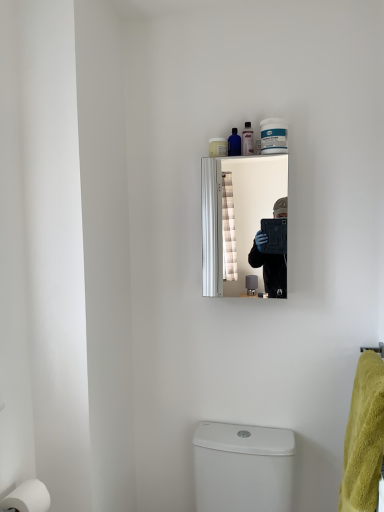
Identify the location of translucent plastic bottle at upper center, positioned as the 1th toiletry in right-to-left order. (247, 140).

Describe the element at coordinates (243, 467) in the screenshot. I see `white glossy toilet at lower center` at that location.

Measure the distance between silver metallic mirror at upper center and camera.

They are 4.86 feet apart.

Describe the element at coordinates (234, 143) in the screenshot. I see `translucent blue bottle at upper center, placed as the 2th toiletry when sorted from right to left` at that location.

In order to face yellow fluffy bath towel at right, should I rotate leftwards or rightwards?

Turn right approximately 22.212 degrees to face it.

You are a GUI agent. You are given a task and a screenshot of the screen. Output one action in this format:
    pyautogui.click(x=<x>, y=<y>)
    Task: Click on the translucent plastic bottle at upper center, positioned as the 1th toiletry in right-to-left order
    The width and height of the screenshot is (384, 512).
    Given the screenshot: What is the action you would take?
    pyautogui.click(x=247, y=140)

Which object is closer to the camera, translucent plastic bottle at upper center, positioned as the 3th toiletry in left-to-right order, or translucent plastic soap dispenser at upper center, the third toiletry viewed from the right?

translucent plastic bottle at upper center, positioned as the 3th toiletry in left-to-right order, is in front.

From the image's perspective, relative to translucent plastic soap dispenser at upper center, the third toiletry viewed from the right, is translucent plastic bottle at upper center, positioned as the 3th toiletry in left-to-right order, above or below?

From the image's perspective, translucent plastic bottle at upper center, positioned as the 3th toiletry in left-to-right order, appears above translucent plastic soap dispenser at upper center, the third toiletry viewed from the right.

How different are the orientations of translucent plastic bottle at upper center, positioned as the 1th toiletry in right-to-left order, and translucent plastic soap dispenser at upper center, the first toiletry in the left-to-right sequence, in degrees?

The angle between the facing direction of translucent plastic bottle at upper center, positioned as the 1th toiletry in right-to-left order, and the facing direction of translucent plastic soap dispenser at upper center, the first toiletry in the left-to-right sequence, is 0.018 degrees.

Does translucent plastic bottle at upper center, positioned as the 1th toiletry in right-to-left order, appear on the right side of translucent plastic soap dispenser at upper center, the first toiletry in the left-to-right sequence?

Yes, translucent plastic bottle at upper center, positioned as the 1th toiletry in right-to-left order, is to the right of translucent plastic soap dispenser at upper center, the first toiletry in the left-to-right sequence.

Would you consider white glossy toilet at lower center to be distant from silver metallic mirror at upper center?

No, there isn't a large distance between white glossy toilet at lower center and silver metallic mirror at upper center.

From the image's perspective, is white glossy toilet at lower center over silver metallic mirror at upper center?

No, from the image's perspective, white glossy toilet at lower center is not over silver metallic mirror at upper center.

Looking at this image, is white glossy toilet at lower center looking in the opposite direction of silver metallic mirror at upper center?

No, white glossy toilet at lower center is not facing away from silver metallic mirror at upper center.

The height and width of the screenshot is (512, 384). Identify the location of toilet bowl that is in front of the white matte toilet paper at lower left. (243, 467).

Is white glossy toilet at lower center smaller than white matte toilet paper at lower left?

No, white glossy toilet at lower center is not smaller than white matte toilet paper at lower left.

Is white glossy toilet at lower center to the right of white matte toilet paper at lower left from the viewer's perspective?

Yes, white glossy toilet at lower center is to the right of white matte toilet paper at lower left.

Does white glossy toilet at lower center have a greater height compared to white matte toilet paper at lower left?

Correct, white glossy toilet at lower center is much taller as white matte toilet paper at lower left.

Is the position of translucent plastic bottle at upper center, positioned as the 3th toiletry in left-to-right order, more distant than that of silver metallic mirror at upper center?

Yes, translucent plastic bottle at upper center, positioned as the 3th toiletry in left-to-right order, is behind silver metallic mirror at upper center.

Considering the positions of points (245, 130) and (206, 250), is point (245, 130) farther from camera compared to point (206, 250)?

No, (245, 130) is in front of (206, 250).

Are translucent plastic bottle at upper center, positioned as the 3th toiletry in left-to-right order, and silver metallic mirror at upper center far apart?

No, translucent plastic bottle at upper center, positioned as the 3th toiletry in left-to-right order, is not far from silver metallic mirror at upper center.

Which of these two, translucent plastic bottle at upper center, positioned as the 3th toiletry in left-to-right order, or silver metallic mirror at upper center, is thinner?

Thinner between the two is translucent plastic bottle at upper center, positioned as the 3th toiletry in left-to-right order.

Is translucent plastic bottle at upper center, positioned as the 1th toiletry in right-to-left order, taller or shorter than white matte toilet paper at lower left?

In the image, translucent plastic bottle at upper center, positioned as the 1th toiletry in right-to-left order, appears to be taller than white matte toilet paper at lower left.

Which object is positioned more to the left, translucent plastic bottle at upper center, positioned as the 3th toiletry in left-to-right order, or white matte toilet paper at lower left?

white matte toilet paper at lower left.

From a real-world perspective, is translucent plastic bottle at upper center, positioned as the 3th toiletry in left-to-right order, positioned above or below white matte toilet paper at lower left?

From a real-world perspective, translucent plastic bottle at upper center, positioned as the 3th toiletry in left-to-right order, is physically above white matte toilet paper at lower left.

Between translucent plastic bottle at upper center, positioned as the 1th toiletry in right-to-left order, and white matte toilet paper at lower left, which one has larger width?

white matte toilet paper at lower left is wider.

Considering the relative positions of translucent plastic bottle at upper center, positioned as the 3th toiletry in left-to-right order, and translucent blue bottle at upper center, which is the second toiletry in left-to-right order, in the image provided, is translucent plastic bottle at upper center, positioned as the 3th toiletry in left-to-right order, behind translucent blue bottle at upper center, which is the second toiletry in left-to-right order,?

That is False.

Is translucent plastic bottle at upper center, positioned as the 3th toiletry in left-to-right order, not near translucent blue bottle at upper center, which is the second toiletry in left-to-right order?

No, translucent plastic bottle at upper center, positioned as the 3th toiletry in left-to-right order, is not far from translucent blue bottle at upper center, which is the second toiletry in left-to-right order.

Is translucent plastic bottle at upper center, positioned as the 3th toiletry in left-to-right order, positioned with its back to translucent blue bottle at upper center, placed as the 2th toiletry when sorted from right to left?

That's not correct — translucent plastic bottle at upper center, positioned as the 3th toiletry in left-to-right order, is not looking away from translucent blue bottle at upper center, placed as the 2th toiletry when sorted from right to left.

Consider the image. From a real-world perspective, is translucent plastic bottle at upper center, positioned as the 3th toiletry in left-to-right order, over translucent blue bottle at upper center, which is the second toiletry in left-to-right order?

Yes, from a real-world perspective, translucent plastic bottle at upper center, positioned as the 3th toiletry in left-to-right order, is on top of translucent blue bottle at upper center, which is the second toiletry in left-to-right order.

How different are the orientations of white matte toilet paper at lower left and silver metallic mirror at upper center in degrees?

white matte toilet paper at lower left and silver metallic mirror at upper center are facing 90.3 degrees away from each other.

Considering the relative sizes of white matte toilet paper at lower left and silver metallic mirror at upper center in the image provided, is white matte toilet paper at lower left bigger than silver metallic mirror at upper center?

No, white matte toilet paper at lower left is not bigger than silver metallic mirror at upper center.

Is white matte toilet paper at lower left positioned before silver metallic mirror at upper center?

Yes, white matte toilet paper at lower left is in front of silver metallic mirror at upper center.

From a real-world perspective, which object stands above the other?

silver metallic mirror at upper center.

At what (x,y) coordinates should I click in order to perform the action: click on the 2nd toiletry positioned below the translucent plastic bottle at upper center, positioned as the 3th toiletry in left-to-right order (from the image's perspective). Please return your answer as a coordinate pair (x, y). Image resolution: width=384 pixels, height=512 pixels. Looking at the image, I should click on (217, 147).

The image size is (384, 512). In order to click on toilet bowl in front of the silver metallic mirror at upper center in this screenshot , I will do (x=243, y=467).

When comparing their distances from yellow fluffy bath towel at right, does translucent plastic bottle at upper center, positioned as the 1th toiletry in right-to-left order, or translucent blue bottle at upper center, placed as the 2th toiletry when sorted from right to left, seem further?

translucent blue bottle at upper center, placed as the 2th toiletry when sorted from right to left, is further to yellow fluffy bath towel at right.

From the image, which object appears to be farther from translucent blue bottle at upper center, which is the second toiletry in left-to-right order, translucent plastic soap dispenser at upper center, the third toiletry viewed from the right, or translucent plastic bottle at upper center, positioned as the 1th toiletry in right-to-left order?

The object further to translucent blue bottle at upper center, which is the second toiletry in left-to-right order, is translucent plastic soap dispenser at upper center, the third toiletry viewed from the right.

Based on their spatial positions, is translucent blue bottle at upper center, placed as the 2th toiletry when sorted from right to left, or white glossy toilet at lower center further from white matte toilet paper at lower left?

The object further to white matte toilet paper at lower left is translucent blue bottle at upper center, placed as the 2th toiletry when sorted from right to left.

Based on their spatial positions, is yellow fluffy bath towel at right or translucent plastic bottle at upper center, positioned as the 3th toiletry in left-to-right order, further from translucent blue bottle at upper center, which is the second toiletry in left-to-right order?

yellow fluffy bath towel at right is positioned further to the anchor translucent blue bottle at upper center, which is the second toiletry in left-to-right order.

Estimate the real-world distances between objects in this image. Which object is closer to white glossy toilet at lower center, silver metallic mirror at upper center or white matte toilet paper at lower left?

Among the two, white matte toilet paper at lower left is located nearer to white glossy toilet at lower center.

In the scene shown: From the image, which object appears to be farther from translucent plastic bottle at upper center, positioned as the 1th toiletry in right-to-left order, translucent plastic soap dispenser at upper center, the third toiletry viewed from the right, or translucent blue bottle at upper center, which is the second toiletry in left-to-right order?

Among the two, translucent plastic soap dispenser at upper center, the third toiletry viewed from the right, is located further to translucent plastic bottle at upper center, positioned as the 1th toiletry in right-to-left order.

Which object lies further to the anchor point translucent plastic bottle at upper center, positioned as the 3th toiletry in left-to-right order, yellow fluffy bath towel at right or silver metallic mirror at upper center?

Among the two, yellow fluffy bath towel at right is located further to translucent plastic bottle at upper center, positioned as the 3th toiletry in left-to-right order.

Which object lies further to the anchor point white glossy toilet at lower center, silver metallic mirror at upper center or translucent plastic soap dispenser at upper center, the first toiletry in the left-to-right sequence?

translucent plastic soap dispenser at upper center, the first toiletry in the left-to-right sequence, lies further to white glossy toilet at lower center than the other object.

Identify the location of mirror that lies between translucent plastic soap dispenser at upper center, the third toiletry viewed from the right, and white matte toilet paper at lower left from top to bottom. (236, 216).

This screenshot has height=512, width=384. Identify the location of mirror between translucent blue bottle at upper center, which is the second toiletry in left-to-right order, and white glossy toilet at lower center from top to bottom. (236, 216).

Image resolution: width=384 pixels, height=512 pixels. I want to click on toiletry between translucent blue bottle at upper center, placed as the 2th toiletry when sorted from right to left, and silver metallic mirror at upper center vertically, so click(217, 147).

Find the location of a particular element. This screenshot has width=384, height=512. toilet paper between translucent blue bottle at upper center, placed as the 2th toiletry when sorted from right to left, and white glossy toilet at lower center in the up-down direction is located at coordinates (28, 497).